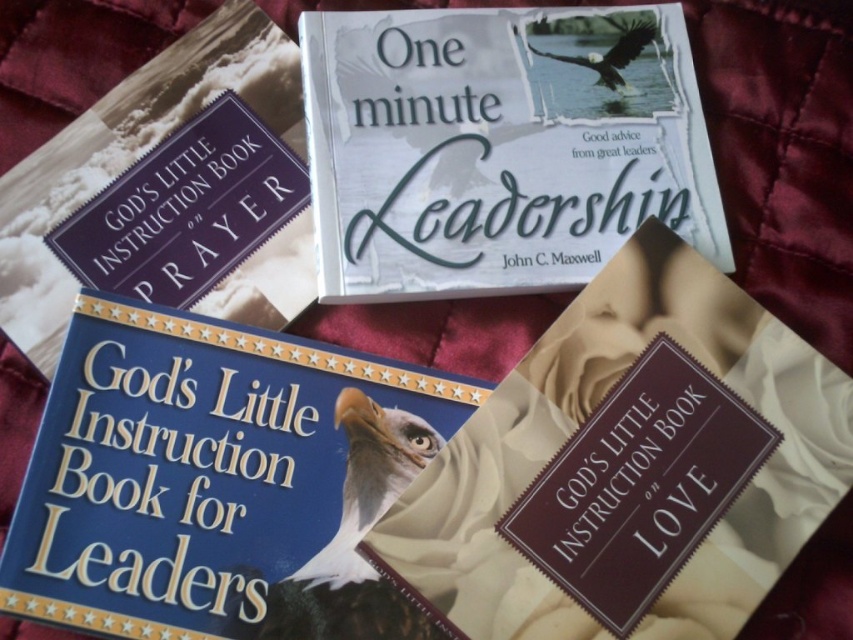
Who is more distant from viewer, (798,541) or (82,147)?

The point (82,147) is behind.

Does matte brown book on love at lower right appear under matte blue book on the left?

Yes, matte brown book on love at lower right is below matte blue book on the left.

Looking at this image, who is more distant from viewer, [450,534] or [35,188]?

Positioned behind is point [35,188].

You are a GUI agent. You are given a task and a screenshot of the screen. Output one action in this format:
    pyautogui.click(x=<x>, y=<y>)
    Task: Click on the matte brown book on love at lower right
    
    Given the screenshot: What is the action you would take?
    pyautogui.click(x=585, y=419)

Describe the element at coordinates (498, 147) in the screenshot. I see `white paper book at center` at that location.

Between point (367, 275) and point (663, 257), which one is positioned behind?

Point (367, 275)

Is point (395, 118) more distant than point (821, 464)?

That is True.

Find the location of `white paper book at center`. white paper book at center is located at coordinates (498, 147).

Is blue hardcover book at center shorter than white paper book at center?

Indeed, blue hardcover book at center has a lesser height compared to white paper book at center.

Which is above, blue hardcover book at center or white paper book at center?

white paper book at center

Which is in front, point (173, 500) or point (386, 248)?

Positioned in front is point (173, 500).

At what (x,y) coordinates should I click in order to perform the action: click on blue hardcover book at center. Please return your answer as a coordinate pair (x, y). Image resolution: width=853 pixels, height=640 pixels. Looking at the image, I should click on (207, 470).